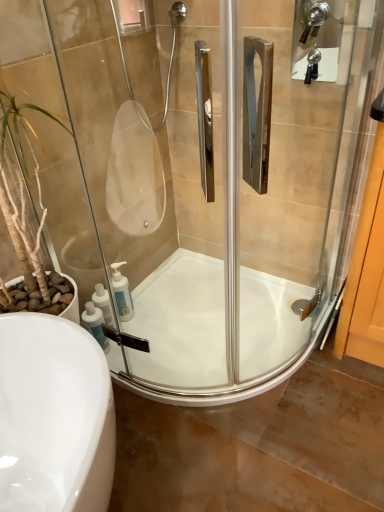
Question: From the image's perspective, is satin nickel faucet at upper right above or below white glossy bath at center?

Choices:
 (A) above
 (B) below

Answer: (A)

Question: From a real-world perspective, is satin nickel faucet at upper right above or below white glossy bath at center?

Choices:
 (A) above
 (B) below

Answer: (A)

Question: Considering the real-world distances, which object is farthest from the white plastic soap dispenser at lower left, acting as the second soap dispenser starting from the front?

Choices:
 (A) white glossy bath at center
 (B) white plastic soap dispenser at lower left, which is the 1th soap dispenser in front-to-back order
 (C) satin nickel faucet at upper right
 (D) transparent glass shower door at center

Answer: (C)

Question: Which is nearer to the white plastic soap dispenser at lower left, acting as the second soap dispenser starting from the front?

Choices:
 (A) transparent glass shower door at center
 (B) satin nickel faucet at upper right
 (C) white plastic soap dispenser at lower left, which is the second soap dispenser in back-to-front order
 (D) white glossy bath at center

Answer: (C)